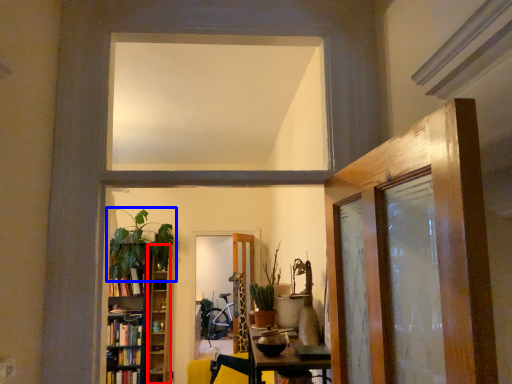
Question: Which point is further to the camera, shelf (highlighted by a red box) or houseplant (highlighted by a blue box)?

Choices:
 (A) shelf
 (B) houseplant

Answer: (A)